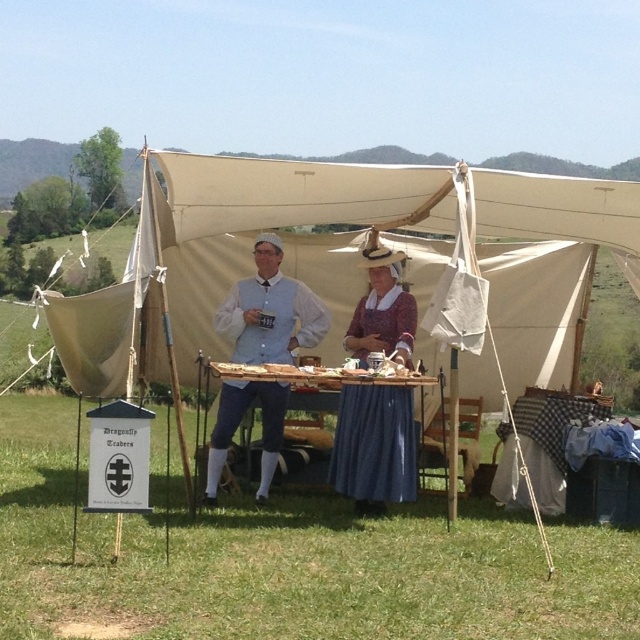
Question: Is beige canvas tent at center bigger than blue fabric table at center?

Choices:
 (A) yes
 (B) no

Answer: (A)

Question: Is beige canvas tent at center below white cotton shirt at center?

Choices:
 (A) yes
 (B) no

Answer: (B)

Question: Is rustic wooden table at center further to the viewer compared to white cotton shirt at center?

Choices:
 (A) yes
 (B) no

Answer: (B)

Question: Estimate the real-world distances between objects in this image. Which object is closer to the rustic wooden table at center?

Choices:
 (A) white cotton shirt at center
 (B) blue fabric table at center

Answer: (B)

Question: Which is farther from the rustic wooden table at center?

Choices:
 (A) blue fabric table at center
 (B) white cotton shirt at center
 (C) beige canvas tent at center

Answer: (C)

Question: Which point is closer to the camera?

Choices:
 (A) (312, 264)
 (B) (385, 474)
 (C) (216, 470)
 (D) (308, 385)

Answer: (B)